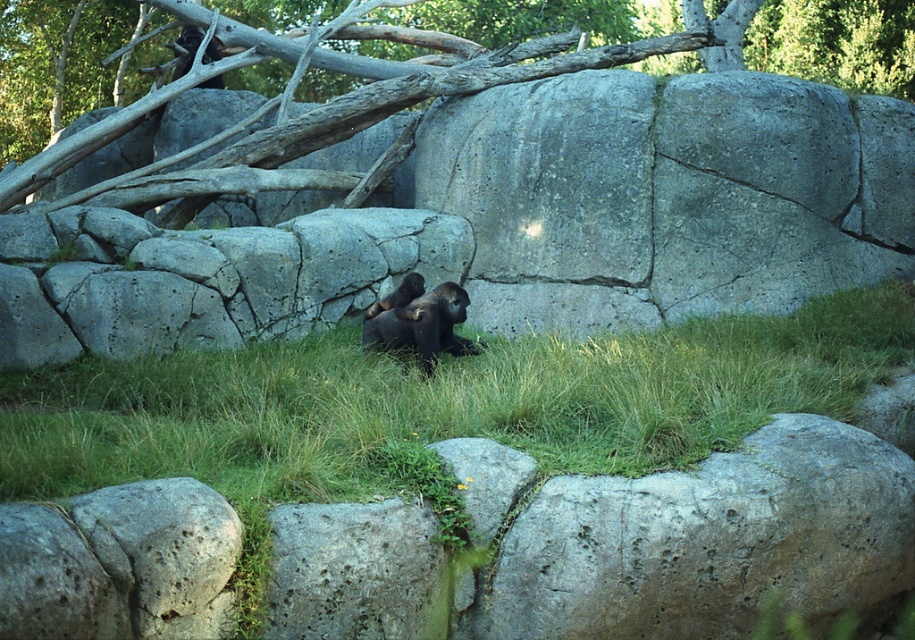
Is green grassy at center behind black fur gorilla at center?

No, it is not.

Who is taller, green grassy at center or black fur gorilla at center?

green grassy at center

Which is behind, point (704, 358) or point (401, 296)?

Point (401, 296)

The height and width of the screenshot is (640, 915). What are the coordinates of `green grassy at center` in the screenshot? It's located at (439, 403).

From the picture: Is shiny black gorilla at center shorter than black fur gorilla at center?

No.

Is shiny black gorilla at center bigger than black fur gorilla at center?

Indeed, shiny black gorilla at center has a larger size compared to black fur gorilla at center.

In order to click on shiny black gorilla at center in this screenshot , I will do `click(420, 323)`.

Locate an element on the screen. The height and width of the screenshot is (640, 915). shiny black gorilla at center is located at coordinates (420, 323).

Is green grassy at center shorter than gray bark tree trunk at upper center?

Indeed, green grassy at center has a lesser height compared to gray bark tree trunk at upper center.

Between green grassy at center and gray bark tree trunk at upper center, which one appears on the left side from the viewer's perspective?

From the viewer's perspective, green grassy at center appears more on the left side.

What do you see at coordinates (439, 403) in the screenshot?
I see `green grassy at center` at bounding box center [439, 403].

This screenshot has width=915, height=640. In order to click on green grassy at center in this screenshot , I will do `click(439, 403)`.